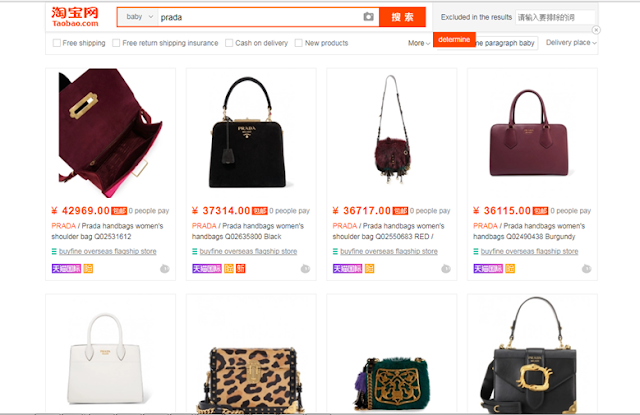
Where is `handle`? This screenshot has height=415, width=640. handle is located at coordinates (267, 96), (511, 110).